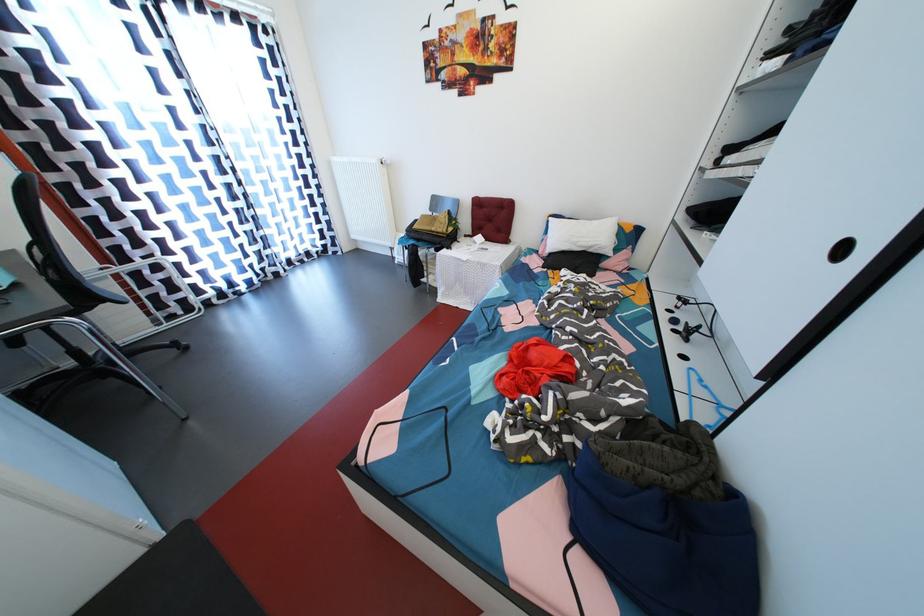
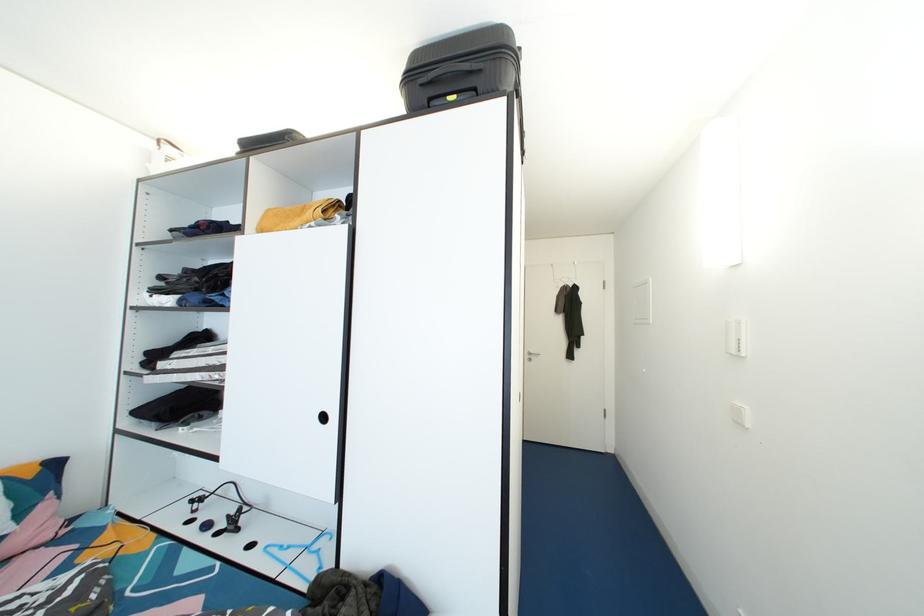
Question: How did the camera likely rotate?

Choices:
 (A) Left
 (B) Right
 (C) Up
 (D) Down

Answer: (B)